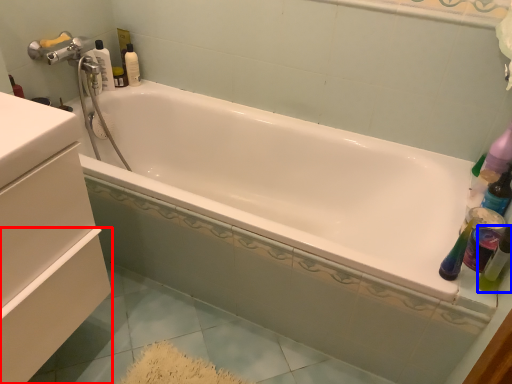
Question: Which of the following is the farthest to the observer, drawer (highlighted by a red box) or mouthwash (highlighted by a blue box)?

Choices:
 (A) drawer
 (B) mouthwash

Answer: (B)